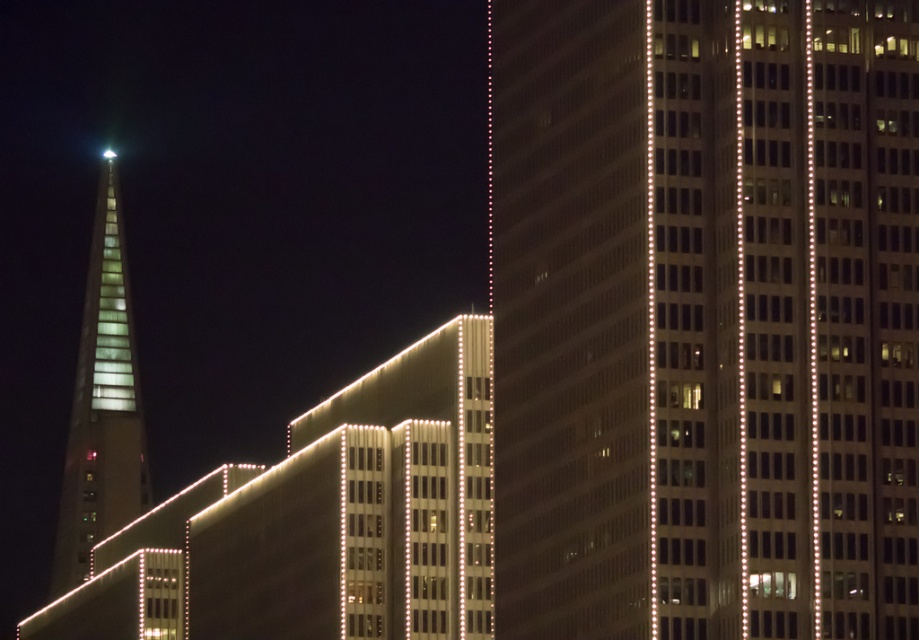
You are a city planner reviewing the urban layout. You notice the translucent glass tower at left and the white translucent light at upper left. Which one is closer to the observer in this scene?

The translucent glass tower at left is closer to the observer because it is positioned in front of the white translucent light at upper left.

From the picture: You are an architect analyzing the urban skyline. You notice the glassy reflective skyscraper at center and the white translucent light at upper left. Which structure is narrower in width?

The glassy reflective skyscraper at center is thinner than the white translucent light at upper left, so the glassy reflective skyscraper at center is narrower in width.

You are an architect analyzing the urban layout. Which of the two structures, the glassy reflective skyscraper at center or the translucent glass tower at left, occupies a wider space in the cityscape?

The translucent glass tower at left is wider than the glassy reflective skyscraper at center, so it occupies a wider space in the cityscape.